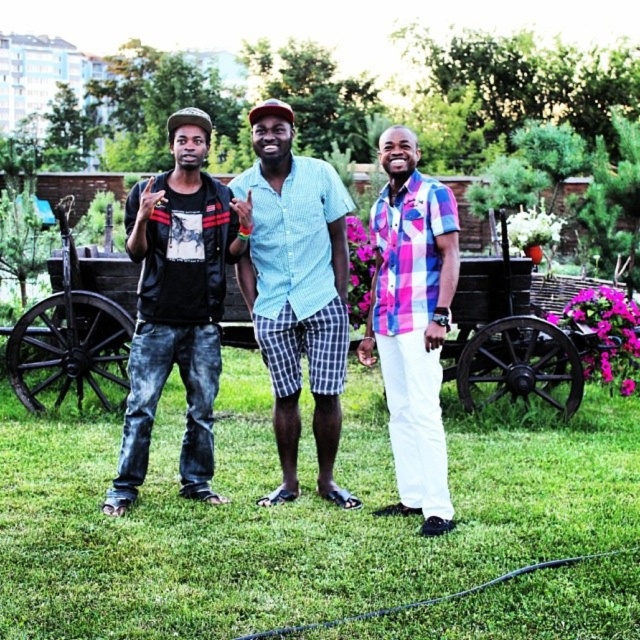
Looking at this image, you are standing in the park and see the green grass at center and the denim jeans at left. Which object is located to the left of the other?

The green grass at center is positioned on the left side of denim jeans at left, meaning the green grass at center is to the left of the denim jeans at left.

You are planning to lay a picnic blanket on the green grass at center. Considering the space occupied by the denim jeans at left, will there be enough room for the blanket?

The green grass at center is wider than the denim jeans at left, so there should be sufficient space to lay the picnic blanket without overlapping the denim jeans at left.